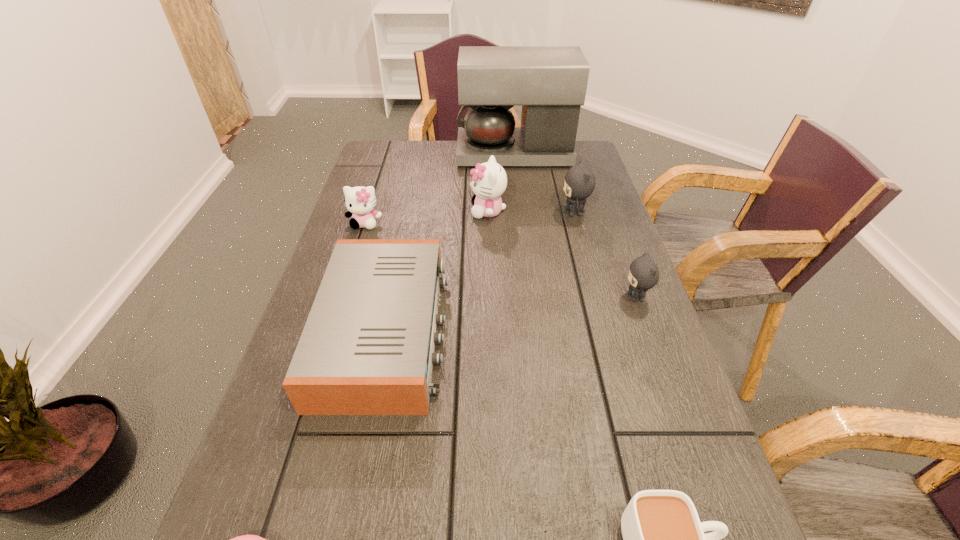
Where is `radio receiver`? radio receiver is located at coordinates (367, 348).

In order to click on vacant space situated on the carafe side of the coffee maker in this screenshot , I will do `click(420, 154)`.

Where is `free space located 0.170m on the carafe side of the coffee maker`? free space located 0.170m on the carafe side of the coffee maker is located at coordinates (408, 154).

The width and height of the screenshot is (960, 540). What are the coordinates of `vacant space located on the carafe side of the coffee maker` in the screenshot? It's located at (431, 154).

This screenshot has height=540, width=960. I want to click on vacant space positioned 0.180m on the front-facing side of the bigger white kitten, so click(407, 211).

In order to click on free space located on the front-facing side of the bigger white kitten in this screenshot , I will do `click(435, 211)`.

The height and width of the screenshot is (540, 960). What are the coordinates of `vacant area situated 0.170m on the front-facing side of the bigger white kitten` in the screenshot? It's located at (411, 211).

The width and height of the screenshot is (960, 540). I want to click on vacant point located on the front-facing side of the bigger gray kitten, so click(440, 213).

Where is `vacant space located on the front-facing side of the bigger gray kitten`? This screenshot has width=960, height=540. vacant space located on the front-facing side of the bigger gray kitten is located at coordinates (475, 213).

I want to click on free space located on the front-facing side of the bigger gray kitten, so click(x=500, y=213).